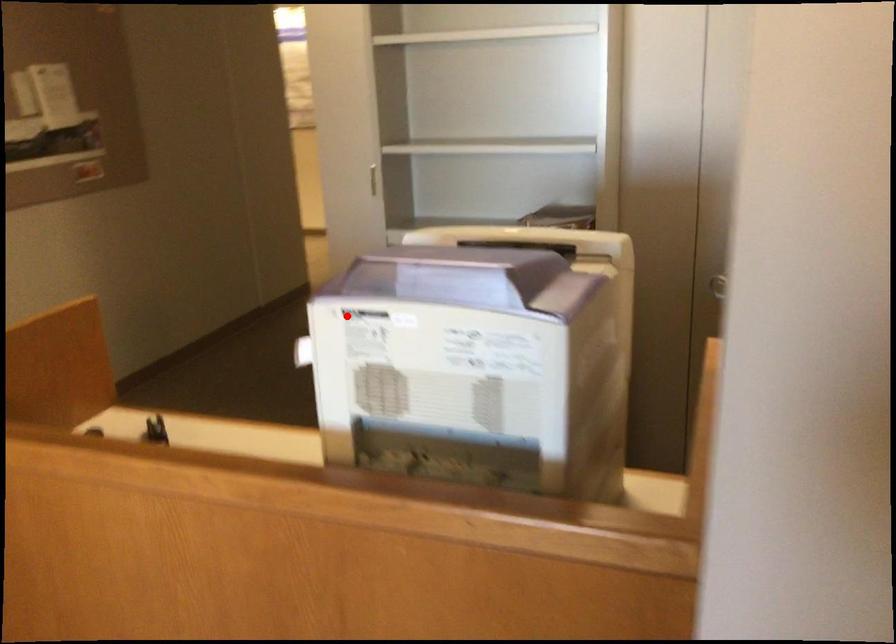
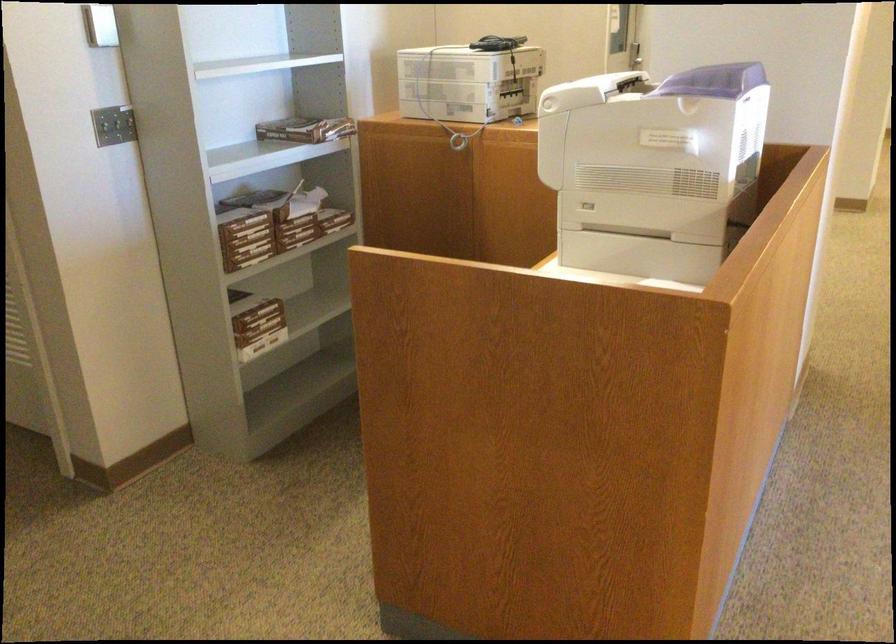
Find the pixel in the second image that matches the highlighted location in the first image.

(714, 80)